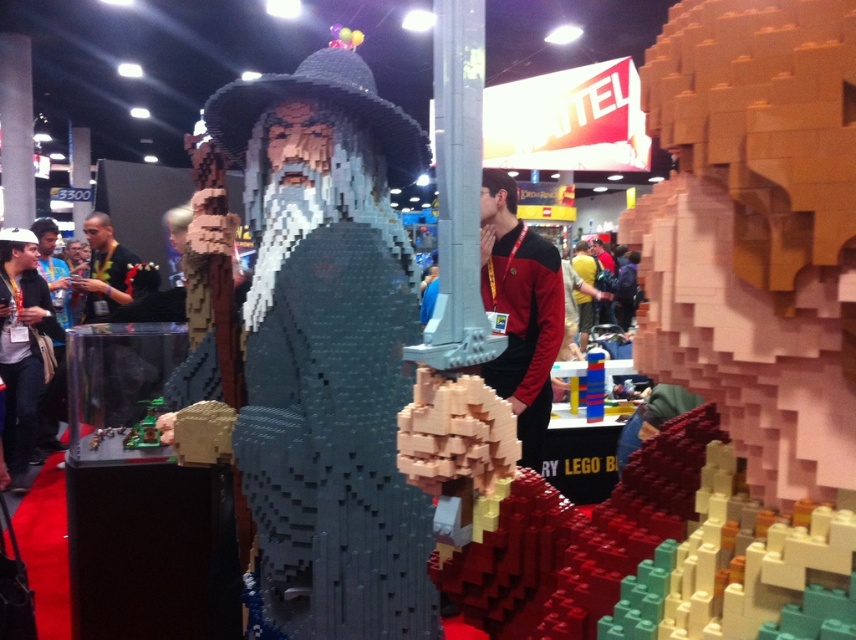
Question: Among these points, which one is nearest to the camera?

Choices:
 (A) (162, 403)
 (B) (114, 253)

Answer: (A)

Question: Can you confirm if black fabric shirt at left is positioned to the left of metallic green toy at center?

Choices:
 (A) yes
 (B) no

Answer: (A)

Question: Which object appears farthest from the camera in this image?

Choices:
 (A) black fabric shirt at left
 (B) metallic green toy at center

Answer: (A)

Question: Is black fabric shirt at left wider than metallic green toy at center?

Choices:
 (A) no
 (B) yes

Answer: (B)

Question: Does black fabric shirt at left appear over metallic green toy at center?

Choices:
 (A) yes
 (B) no

Answer: (A)

Question: Which of the following is the farthest from the observer?

Choices:
 (A) black fabric shirt at left
 (B) metallic green toy at center

Answer: (A)